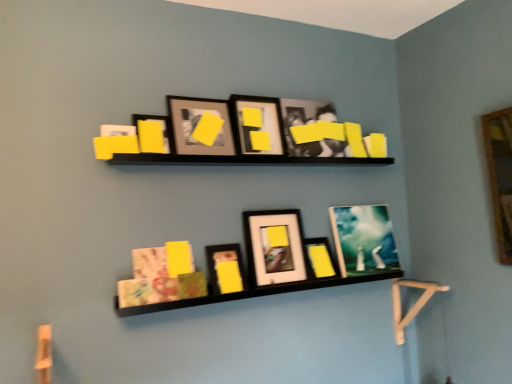
Locate an element on the screen. free space above black matte shelf at center (from a real-world perspective) is located at coordinates click(x=275, y=154).